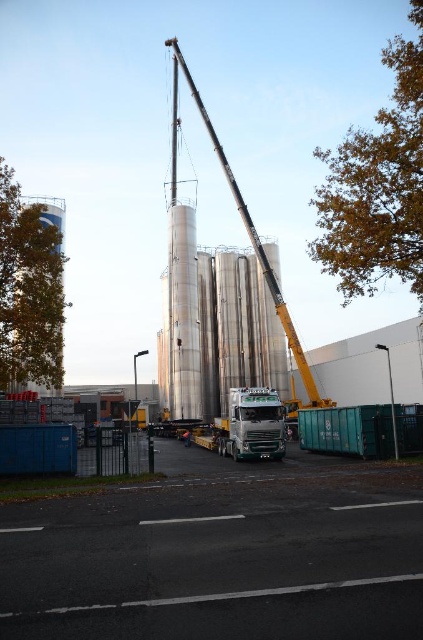
You are standing on the paved road and want to locate the green metallic truck at center. According to the coordinates given, where would you find it?

The green metallic truck at center is located at the coordinates point (252, 424).

From the picture: You are a delivery driver who needs to park your truck near the metallic silver crane at center without blocking the entrance to the brushed metal silo at left. Based on their sizes, which object should you position your truck closer to and why?

The metallic silver crane at center is smaller than the brushed metal silo at left. Therefore, you should position your truck closer to the metallic silver crane at center to avoid blocking the entrance to the larger brushed metal silo at left.

You are a delivery driver who needs to park your green metallic truck at center in a spot that requires precise positioning. What are the coordinates where you should position your truck?

The green metallic truck at center should be positioned at coordinates point (252, 424).